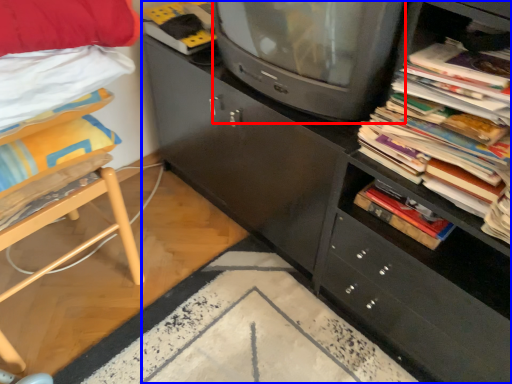
Question: Which point is closer to the camera, television (highlighted by a red box) or cabinetry (highlighted by a blue box)?

Choices:
 (A) television
 (B) cabinetry

Answer: (B)